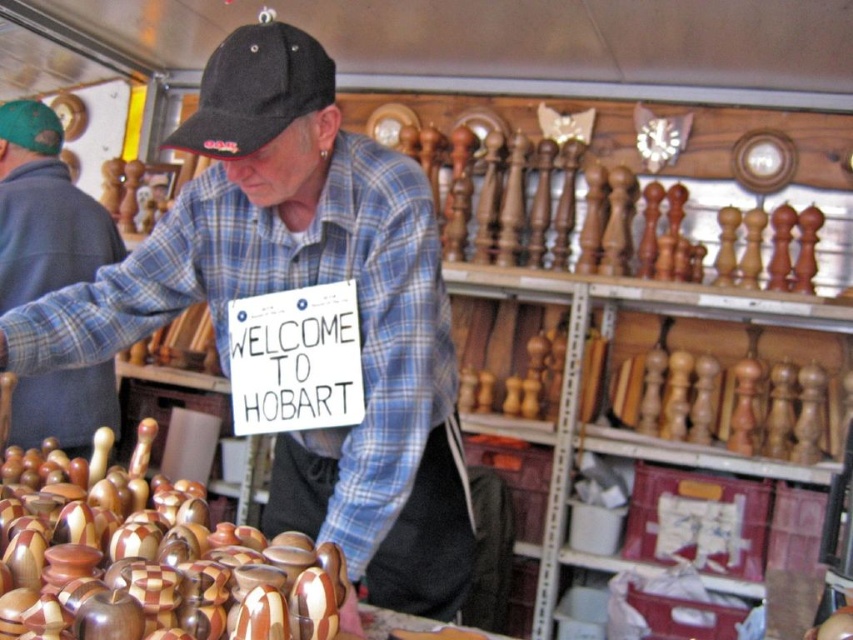
Question: Is blue plaid shirt at center closer to camera compared to black fabric baseball cap at upper center?

Choices:
 (A) no
 (B) yes

Answer: (A)

Question: Among these objects, which one is nearest to the camera?

Choices:
 (A) blue plaid shirt at center
 (B) matte black cap at upper left

Answer: (A)

Question: Among these objects, which one is nearest to the camera?

Choices:
 (A) matte black cap at upper left
 (B) blue plaid shirt at center

Answer: (B)

Question: Can you confirm if blue plaid shirt at center is bigger than matte black cap at upper left?

Choices:
 (A) no
 (B) yes

Answer: (B)

Question: Can you confirm if blue plaid shirt at center is positioned to the left of matte black cap at upper left?

Choices:
 (A) no
 (B) yes

Answer: (A)

Question: Estimate the real-world distances between objects in this image. Which object is farther from the matte black cap at upper left?

Choices:
 (A) blue plaid shirt at center
 (B) black fabric baseball cap at upper center

Answer: (B)